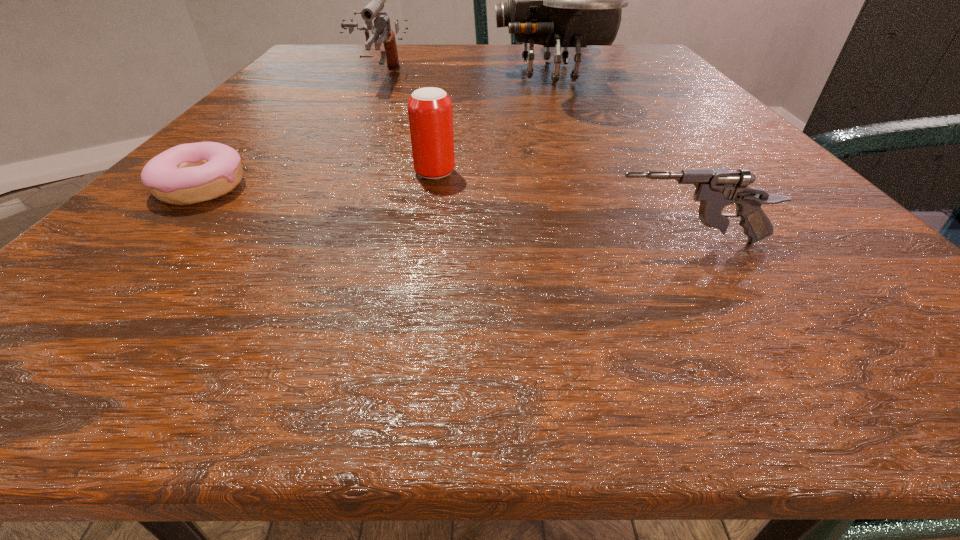
At what (x,y) coordinates should I click in order to perform the action: click on free space located 0.080m on the front-facing side of the drone. Please return your answer as a coordinate pair (x, y). Image resolution: width=960 pixels, height=540 pixels. Looking at the image, I should click on (454, 74).

You are a GUI agent. You are given a task and a screenshot of the screen. Output one action in this format:
    pyautogui.click(x=<x>, y=<y>)
    Task: Click on the free space located on the front-facing side of the drone
    
    Given the screenshot: What is the action you would take?
    pyautogui.click(x=444, y=74)

In order to click on blank space located 0.400m at the barrel end of the taller gun in this screenshot , I will do `click(303, 218)`.

Where is `vacant space located 0.220m on the right of the third object from right to left`? The image size is (960, 540). vacant space located 0.220m on the right of the third object from right to left is located at coordinates (623, 173).

Identify the location of vacant space located at the barrel of the right gun. (515, 242).

Where is `free region located at the barrel of the right gun`? free region located at the barrel of the right gun is located at coordinates (237, 242).

In order to click on vacant area situated at the barrel of the right gun in this screenshot , I will do `click(476, 242)`.

The image size is (960, 540). What are the coordinates of `vacant space positioned on the right of the leftmost object` in the screenshot? It's located at (358, 188).

Where is `drone located at the far edge`? drone located at the far edge is located at coordinates click(x=557, y=0).

This screenshot has width=960, height=540. I want to click on gun at the far edge, so click(x=381, y=27).